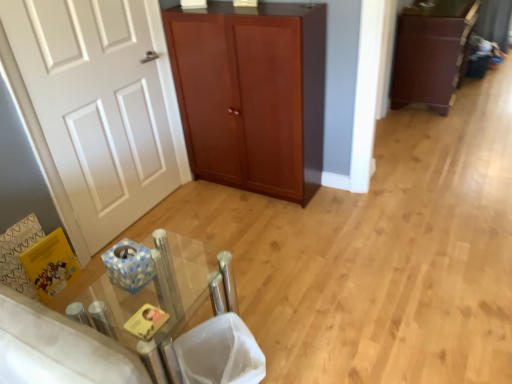
Question: Considering the relative sizes of white mesh laundry basket at lower center and white matte door at left in the image provided, is white mesh laundry basket at lower center shorter than white matte door at left?

Choices:
 (A) no
 (B) yes

Answer: (B)

Question: Can you confirm if white mesh laundry basket at lower center is positioned to the left of white matte door at left?

Choices:
 (A) yes
 (B) no

Answer: (B)

Question: Can you confirm if white mesh laundry basket at lower center is positioned to the right of white matte door at left?

Choices:
 (A) yes
 (B) no

Answer: (A)

Question: Can you confirm if white mesh laundry basket at lower center is bigger than white matte door at left?

Choices:
 (A) no
 (B) yes

Answer: (A)

Question: Is white mesh laundry basket at lower center oriented away from white matte door at left?

Choices:
 (A) yes
 (B) no

Answer: (A)

Question: Considering the relative sizes of white mesh laundry basket at lower center and white matte door at left in the image provided, is white mesh laundry basket at lower center wider than white matte door at left?

Choices:
 (A) no
 (B) yes

Answer: (B)

Question: Does white matte door at left have a smaller size compared to dark brown wood cabinet at right?

Choices:
 (A) yes
 (B) no

Answer: (A)

Question: From the image's perspective, would you say white matte door at left is positioned over dark brown wood cabinet at right?

Choices:
 (A) no
 (B) yes

Answer: (A)

Question: Considering the relative positions of white matte door at left and dark brown wood cabinet at right in the image provided, is white matte door at left to the right of dark brown wood cabinet at right from the viewer's perspective?

Choices:
 (A) yes
 (B) no

Answer: (B)

Question: Is white matte door at left positioned behind dark brown wood cabinet at right?

Choices:
 (A) yes
 (B) no

Answer: (B)

Question: From the image's perspective, is white matte door at left beneath dark brown wood cabinet at right?

Choices:
 (A) no
 (B) yes

Answer: (B)

Question: Is white matte door at left facing away from dark brown wood cabinet at right?

Choices:
 (A) yes
 (B) no

Answer: (B)

Question: From the image's perspective, is white matte door at left on mahogany wood cupboard at center?

Choices:
 (A) yes
 (B) no

Answer: (B)